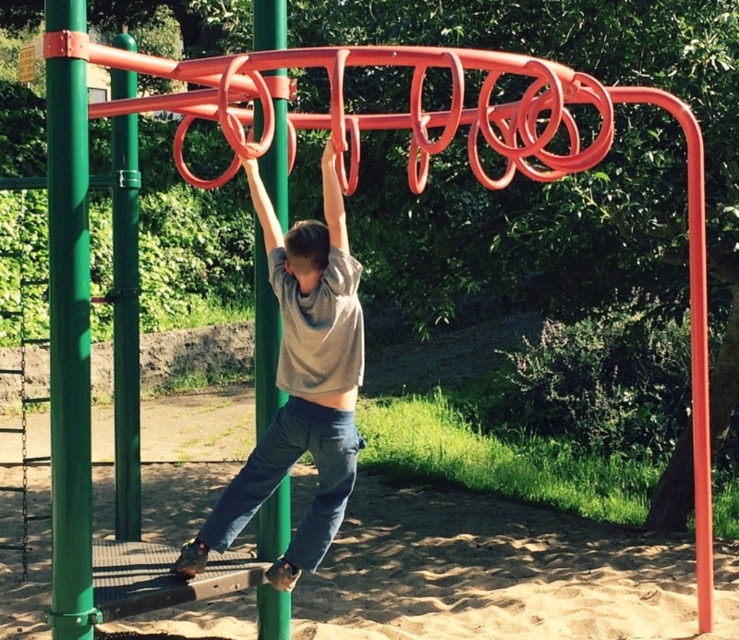
Between point (507, 554) and point (330, 195), which one is positioned in front?

Point (330, 195)

You are a GUI agent. You are given a task and a screenshot of the screen. Output one action in this format:
    pyautogui.click(x=<x>, y=<y>)
    Task: Click on the sandy brown at lower center
    This screenshot has width=739, height=640.
    Given the screenshot: What is the action you would take?
    pyautogui.click(x=490, y=573)

Is point (358, 624) closer to viewer compared to point (268, 186)?

No.

What do you see at coordinates (490, 573) in the screenshot? I see `sandy brown at lower center` at bounding box center [490, 573].

Where is `sandy brown at lower center`? The width and height of the screenshot is (739, 640). sandy brown at lower center is located at coordinates (490, 573).

Which is below, gray cotton shirt at center or green matte pole at center?

gray cotton shirt at center

Does gray cotton shirt at center have a smaller size compared to green matte pole at center?

Actually, gray cotton shirt at center might be larger than green matte pole at center.

Between point (321, 499) and point (268, 516), which one is positioned in front?

Positioned in front is point (321, 499).

What are the coordinates of `gray cotton shirt at center` in the screenshot? It's located at (299, 385).